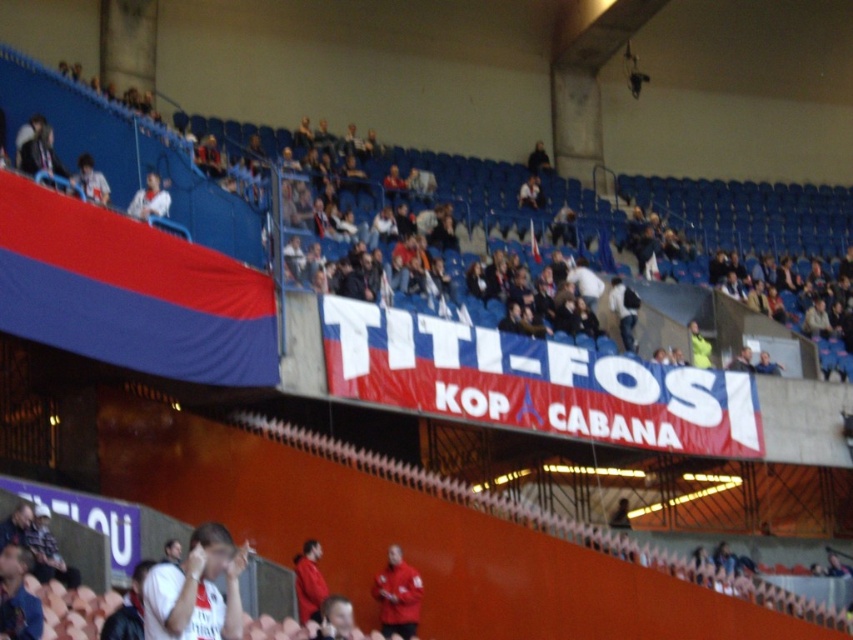
Describe the element at coordinates (397, 595) in the screenshot. This screenshot has width=853, height=640. I see `red matte jacket at center` at that location.

Is point (392, 580) positioned before point (321, 579)?

That is False.

You are a GUI agent. You are given a task and a screenshot of the screen. Output one action in this format:
    pyautogui.click(x=<x>, y=<y>)
    Task: Click on the red matte jacket at center
    The width and height of the screenshot is (853, 640).
    Given the screenshot: What is the action you would take?
    pyautogui.click(x=397, y=595)

Between white matte shirt at center and red matte jacket at center, which one has less height?

red matte jacket at center

Does point (161, 618) come closer to viewer compared to point (415, 605)?

That is True.

This screenshot has height=640, width=853. I want to click on white matte shirt at center, so click(x=196, y=589).

In order to click on white matte shirt at center in this screenshot , I will do `click(196, 589)`.

Can you confirm if white matte shirt at center is shorter than white fabric shirt at upper left?

In fact, white matte shirt at center may be taller than white fabric shirt at upper left.

Between point (218, 524) and point (161, 204), which one is positioned behind?

Positioned behind is point (161, 204).

Where is `white matte shirt at center`? white matte shirt at center is located at coordinates (196, 589).